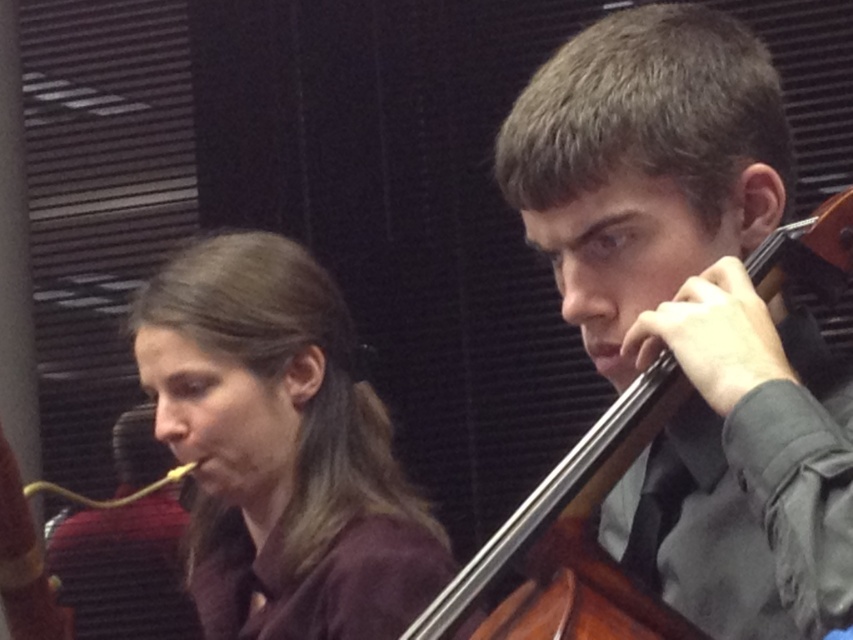
Question: Among these points, which one is farthest from the camera?

Choices:
 (A) (254, 522)
 (B) (579, 460)

Answer: (A)

Question: Does brown matte hair at center appear on the right side of brown wooden cello at center?

Choices:
 (A) yes
 (B) no

Answer: (B)

Question: Is brown matte hair at center bigger than brown wooden cello at center?

Choices:
 (A) no
 (B) yes

Answer: (B)

Question: Can you confirm if brown matte hair at center is bigger than brown wooden cello at center?

Choices:
 (A) no
 (B) yes

Answer: (B)

Question: Which point is closer to the camera?

Choices:
 (A) (228, 282)
 (B) (480, 636)

Answer: (B)